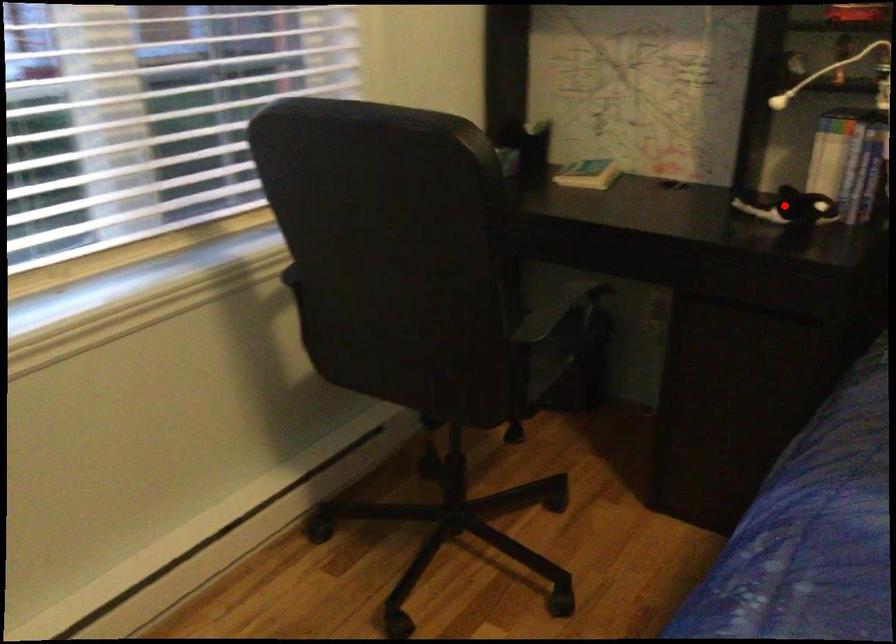
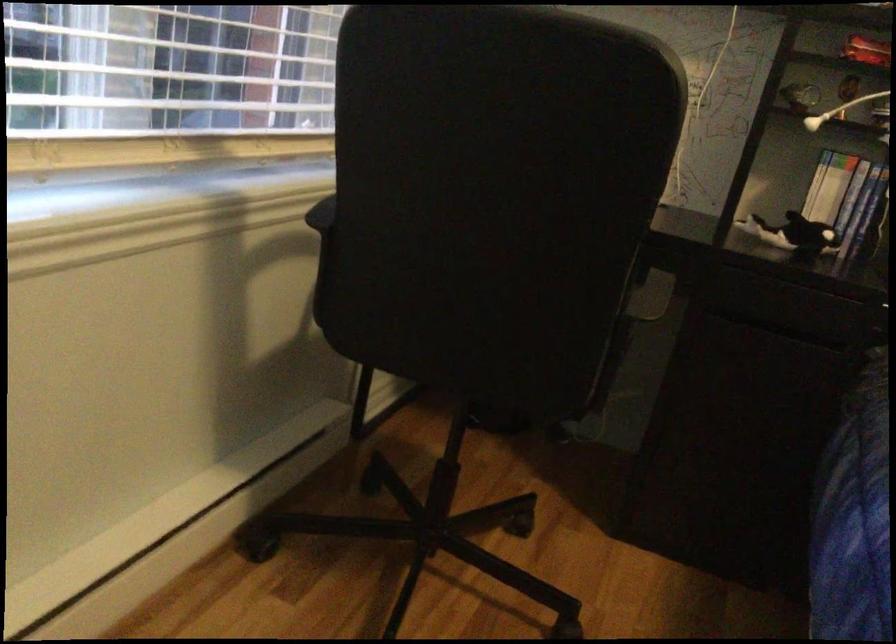
The point at the highlighted location is marked in the first image. Where is the corresponding point in the second image?

(793, 234)